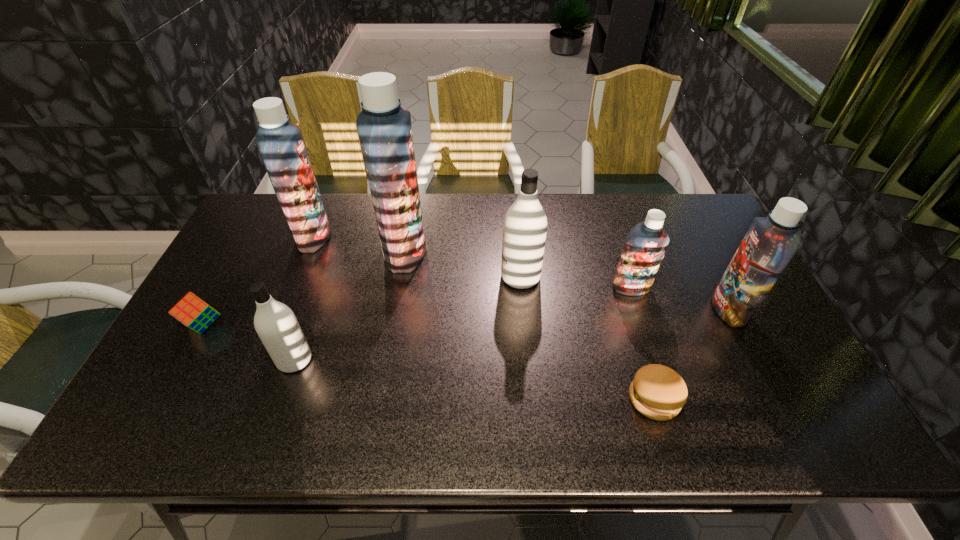
The image size is (960, 540). I want to click on the tallest object, so click(385, 132).

The height and width of the screenshot is (540, 960). In order to click on the biggest blue shampoo in this screenshot , I will do `click(385, 132)`.

I want to click on the third smallest blue shampoo, so pos(281,145).

Where is `the leftmost blue shampoo`? Image resolution: width=960 pixels, height=540 pixels. the leftmost blue shampoo is located at coordinates (281, 145).

Where is `the rightmost shampoo`? This screenshot has width=960, height=540. the rightmost shampoo is located at coordinates (770, 243).

Find the location of `the rightmost object`. the rightmost object is located at coordinates (770, 243).

The image size is (960, 540). In order to click on the right white shampoo in this screenshot , I will do `click(525, 224)`.

Identify the location of the fourth object from right to left. (525, 224).

The width and height of the screenshot is (960, 540). What are the coordinates of `the second nearest object` in the screenshot? It's located at (x=275, y=323).

Where is `the smaller white shampoo`? The image size is (960, 540). the smaller white shampoo is located at coordinates (275, 323).